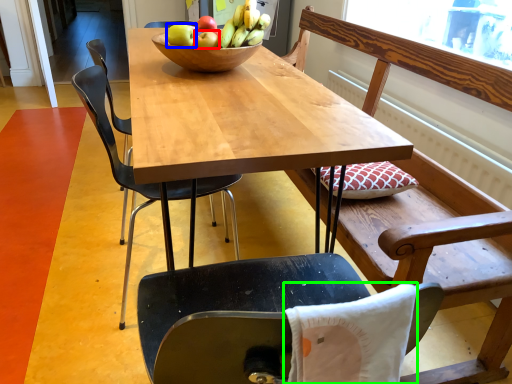
Question: Estimate the real-world distances between objects in this image. Which object is farther from apple (highlighted by a red box), apple (highlighted by a blue box) or pillow (highlighted by a green box)?

Choices:
 (A) apple
 (B) pillow

Answer: (B)